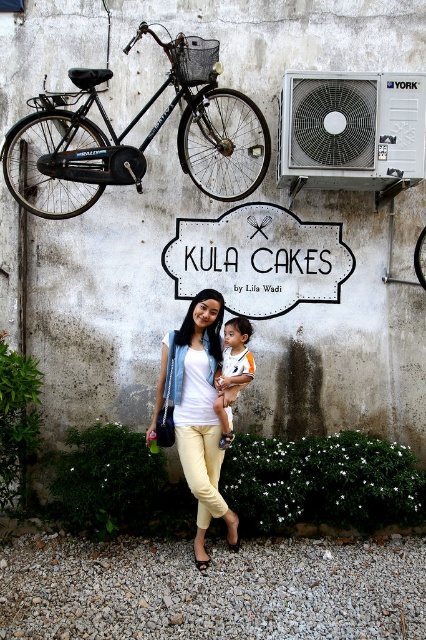
You are a delivery person who needs to determine if the black matte bicycle at upper left can fit through a doorway that is the same height as the white cotton shirt at center. Based on their heights, can the bicycle pass through the doorway?

The black matte bicycle at upper left is taller than the white cotton shirt at center. Since the doorway is the same height as the shirt, the bicycle cannot pass through the doorway because it is taller than the shirt, and thus taller than the doorway.

You are an artist planning to paint this wall. You need to know which object is taller between the black matte bicycle at upper left and the silver metallic air conditioner at upper right to decide where to place your canvas. Which one is taller?

The black matte bicycle at upper left is taller than the silver metallic air conditioner at upper right according to the description.

You are standing in front of a weathered concrete wall with a black matte bicycle at upper left and a white YORK air conditioning unit to its right. Which object is positioned to the left of the other?

The black matte bicycle at upper left is positioned to the left of the white YORK air conditioning unit.